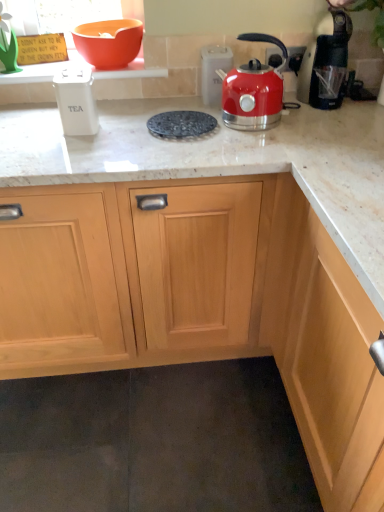
Identify the location of free spot to the right of black plastic coffee maker at upper right, the fourth kitchen appliance in the left-to-right sequence. The width and height of the screenshot is (384, 512). (364, 104).